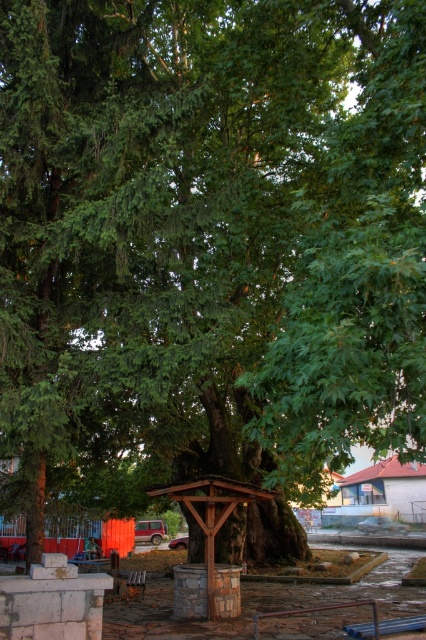
Question: Considering the relative positions of wooden picnic table at center and brown wooden park bench at center in the image provided, where is wooden picnic table at center located with respect to brown wooden park bench at center?

Choices:
 (A) right
 (B) left

Answer: (B)

Question: Which object is farther from the camera taking this photo?

Choices:
 (A) brown wooden park bench at center
 (B) wooden picnic table at center

Answer: (B)

Question: Can you confirm if wooden picnic table at center is positioned above brown wooden park bench at center?

Choices:
 (A) no
 (B) yes

Answer: (A)

Question: Which point is closer to the camera taking this photo?

Choices:
 (A) (86, 554)
 (B) (141, 579)

Answer: (B)

Question: Can you confirm if wooden picnic table at center is positioned to the left of brown wooden park bench at center?

Choices:
 (A) yes
 (B) no

Answer: (A)